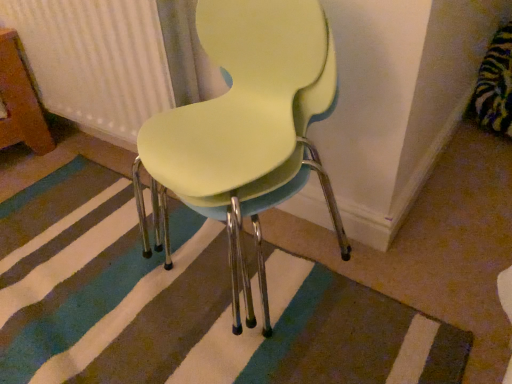
Question: Considering the relative positions of matte yellow plastic chair at center and white textured radiator at upper left in the image provided, is matte yellow plastic chair at center to the left or to the right of white textured radiator at upper left?

Choices:
 (A) right
 (B) left

Answer: (A)

Question: From the image's perspective, relative to white textured radiator at upper left, is matte yellow plastic chair at center above or below?

Choices:
 (A) above
 (B) below

Answer: (B)

Question: Based on their relative distances, which object is nearer to the white textured radiator at upper left?

Choices:
 (A) matte yellow plastic chair at center
 (B) striped carpet at center

Answer: (A)

Question: Considering the real-world distances, which object is farthest from the white textured radiator at upper left?

Choices:
 (A) matte yellow plastic chair at center
 (B) striped carpet at center

Answer: (B)